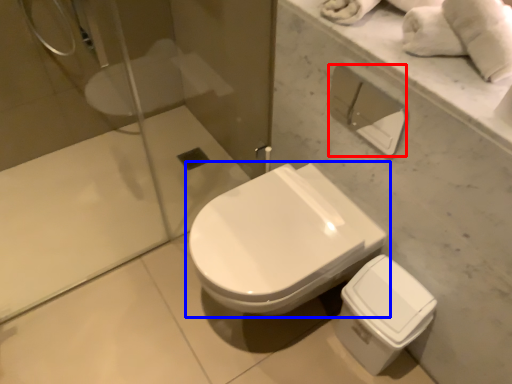
Question: Which object is closer to the camera taking this photo, toilet paper (highlighted by a red box) or toilet (highlighted by a blue box)?

Choices:
 (A) toilet paper
 (B) toilet

Answer: (A)